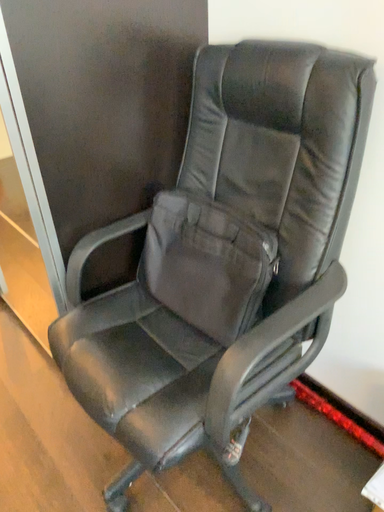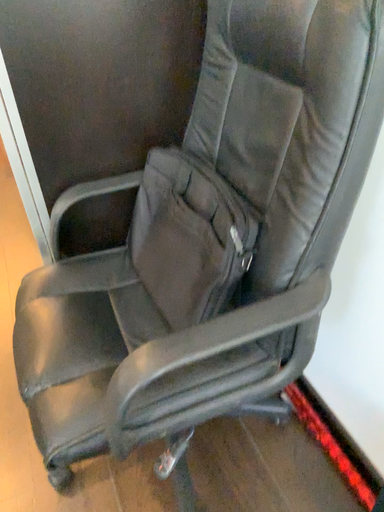
Question: How did the camera likely rotate when shooting the video?

Choices:
 (A) rotated left
 (B) rotated right

Answer: (A)